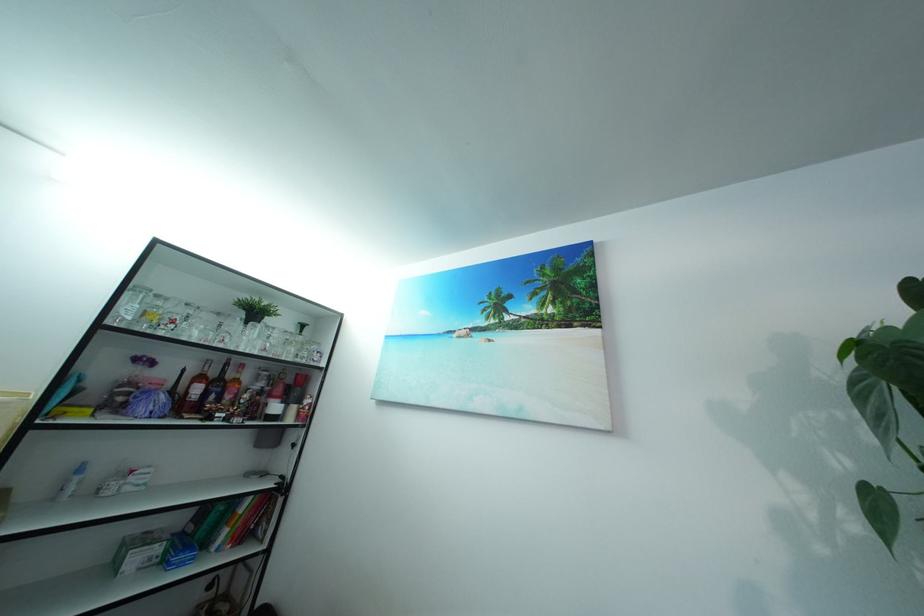
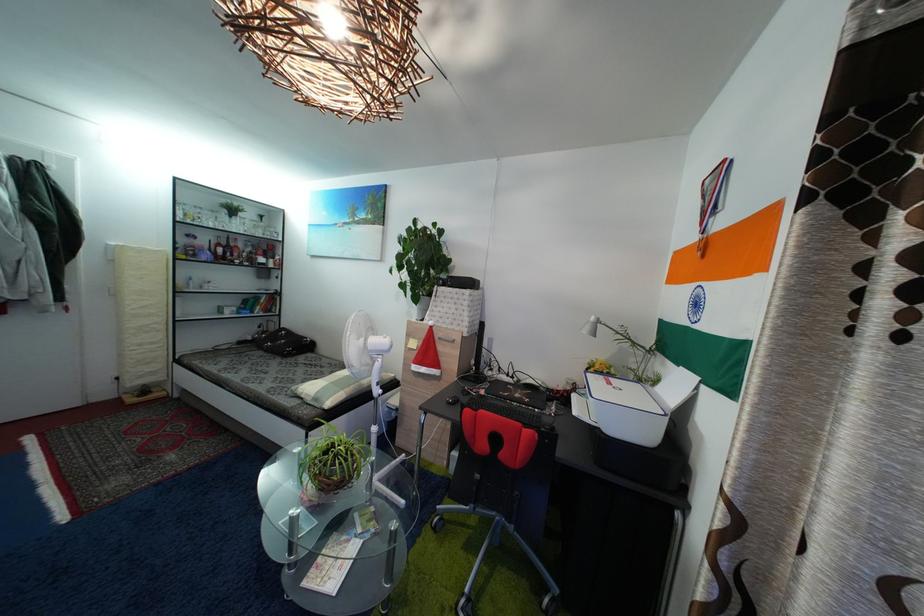
In the second image, find the point that corresponds to [222,381] in the first image.

(233, 251)